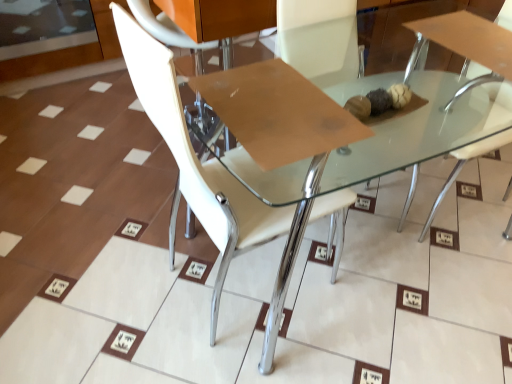
Where is `transparent glass door at upper left`? This screenshot has height=384, width=512. transparent glass door at upper left is located at coordinates (44, 26).

Describe the element at coordinates (277, 113) in the screenshot. The width and height of the screenshot is (512, 384). I see `brown matte cardboard at center` at that location.

The height and width of the screenshot is (384, 512). Describe the element at coordinates (195, 161) in the screenshot. I see `white glossy chair at center, the 1th chair in the left-to-right sequence` at that location.

This screenshot has height=384, width=512. I want to click on clear glass table at center, so click(x=371, y=160).

From the picture: Is white glossy chair at upper right, the 2th chair positioned from the left, facing towards clear glass table at center?

Yes, white glossy chair at upper right, the 2th chair positioned from the left, faces towards clear glass table at center.

Are white glossy chair at upper right, which is the 1th chair from right to left, and clear glass table at center located far from each other?

No.

Is point (457, 91) positioned before point (369, 143)?

No, it is not.

Who is smaller, white glossy chair at upper right, which is the 1th chair from right to left, or brown matte cardboard at center?

brown matte cardboard at center.

Between white glossy chair at upper right, which is the 1th chair from right to left, and brown matte cardboard at center, which one is positioned in front?

brown matte cardboard at center.

The height and width of the screenshot is (384, 512). Find the location of `cardboard lying on the left of white glossy chair at upper right, the 2th chair positioned from the left`. cardboard lying on the left of white glossy chair at upper right, the 2th chair positioned from the left is located at coordinates (277, 113).

Is white glossy chair at upper right, which is the 1th chair from right to left, next to brown matte cardboard at center?

They are not placed beside each other.

Is transparent glass door at upper left wider or thinner than white glossy chair at upper right, which is the 1th chair from right to left?

Clearly, transparent glass door at upper left has more width compared to white glossy chair at upper right, which is the 1th chair from right to left.

Locate an element on the screen. The height and width of the screenshot is (384, 512). the 1st chair below the transparent glass door at upper left (from the image's perspective) is located at coordinates (469, 49).

Does point (13, 35) appear closer or farther from the camera than point (438, 195)?

Point (13, 35) appears to be farther away from the viewer than point (438, 195).

Would you say transparent glass door at upper left is outside white glossy chair at center, the 1th chair in the left-to-right sequence?

Yes, transparent glass door at upper left is not within white glossy chair at center, the 1th chair in the left-to-right sequence.

Considering the relative positions of transparent glass door at upper left and white glossy chair at center, which is the second chair in right-to-left order, in the image provided, is transparent glass door at upper left in front of white glossy chair at center, which is the second chair in right-to-left order,?

No, transparent glass door at upper left is further to the viewer.

Does point (29, 27) come farther from viewer compared to point (252, 238)?

Yes, it is.

How distant is transparent glass door at upper left from white glossy chair at center, which is the second chair in right-to-left order?

transparent glass door at upper left and white glossy chair at center, which is the second chair in right-to-left order, are 1.74 meters apart from each other.

Who is shorter, clear glass table at center or transparent glass door at upper left?

transparent glass door at upper left.

From the image's perspective, is clear glass table at center over transparent glass door at upper left?

Actually, clear glass table at center appears below transparent glass door at upper left in the image.

Considering the relative sizes of clear glass table at center and transparent glass door at upper left in the image provided, is clear glass table at center smaller than transparent glass door at upper left?

No, clear glass table at center is not smaller than transparent glass door at upper left.

Does clear glass table at center touch transparent glass door at upper left?

clear glass table at center and transparent glass door at upper left are not in contact.

Which of these two, white glossy chair at center, which is the second chair in right-to-left order, or clear glass table at center, is bigger?

clear glass table at center is bigger.

Which of these two, white glossy chair at center, which is the second chair in right-to-left order, or clear glass table at center, is wider?

clear glass table at center is wider.

Is clear glass table at center at the back of white glossy chair at center, the 1th chair in the left-to-right sequence?

Yes, white glossy chair at center, the 1th chair in the left-to-right sequence,'s orientation is away from clear glass table at center.

Between clear glass table at center and brown matte cardboard at center, which one is positioned behind?

Positioned behind is brown matte cardboard at center.

From a real-world perspective, which object rests below the other?

clear glass table at center, from a real-world perspective.

Can you confirm if clear glass table at center is positioned to the left of brown matte cardboard at center?

Incorrect, clear glass table at center is not on the left side of brown matte cardboard at center.

Can you tell me how much clear glass table at center and brown matte cardboard at center differ in facing direction?

1.75e-05 degrees separate the facing orientations of clear glass table at center and brown matte cardboard at center.

Find the location of a particular element. The width and height of the screenshot is (512, 384). round table that appears below the white glossy chair at upper right, which is the 1th chair from right to left (from a real-world perspective) is located at coordinates (371, 160).

Where is `chair above the brown matte cardboard at center (from the image's perspective)`? This screenshot has height=384, width=512. chair above the brown matte cardboard at center (from the image's perspective) is located at coordinates (469, 49).

Based on their spatial positions, is brown matte cardboard at center or transparent glass door at upper left further from clear glass table at center?

transparent glass door at upper left.

Considering their positions, is white glossy chair at center, which is the second chair in right-to-left order, positioned further to transparent glass door at upper left than brown matte cardboard at center?

brown matte cardboard at center is further to transparent glass door at upper left.

Estimate the real-world distances between objects in this image. Which object is further from white glossy chair at upper right, the 2th chair positioned from the left, white glossy chair at center, which is the second chair in right-to-left order, or transparent glass door at upper left?

transparent glass door at upper left is further to white glossy chair at upper right, the 2th chair positioned from the left.

When comparing their distances from clear glass table at center, does transparent glass door at upper left or white glossy chair at upper right, which is the 1th chair from right to left, seem further?

transparent glass door at upper left is further to clear glass table at center.

From the image, which object appears to be farther from transparent glass door at upper left, white glossy chair at upper right, the 2th chair positioned from the left, or clear glass table at center?

Among the two, white glossy chair at upper right, the 2th chair positioned from the left, is located further to transparent glass door at upper left.

Estimate the real-world distances between objects in this image. Which object is further from brown matte cardboard at center, white glossy chair at center, which is the second chair in right-to-left order, or transparent glass door at upper left?

The object further to brown matte cardboard at center is transparent glass door at upper left.

Which object lies further to the anchor point white glossy chair at upper right, the 2th chair positioned from the left, transparent glass door at upper left or brown matte cardboard at center?

transparent glass door at upper left is positioned further to the anchor white glossy chair at upper right, the 2th chair positioned from the left.

Estimate the real-world distances between objects in this image. Which object is closer to transparent glass door at upper left, brown matte cardboard at center or clear glass table at center?

clear glass table at center is closer to transparent glass door at upper left.

The image size is (512, 384). I want to click on cardboard between white glossy chair at center, which is the second chair in right-to-left order, and transparent glass door at upper left in the front-back direction, so click(277, 113).

Locate an element on the screen. chair located between transparent glass door at upper left and white glossy chair at upper right, which is the 1th chair from right to left, in the left-right direction is located at coordinates (195, 161).

At what (x,y) coordinates should I click in order to perform the action: click on round table between white glossy chair at center, which is the second chair in right-to-left order, and white glossy chair at upper right, the 2th chair positioned from the left, in the horizontal direction. Please return your answer as a coordinate pair (x, y). This screenshot has width=512, height=384. Looking at the image, I should click on (371, 160).

Find the location of a particular element. round table situated between transparent glass door at upper left and white glossy chair at upper right, which is the 1th chair from right to left, from left to right is located at coordinates (371, 160).